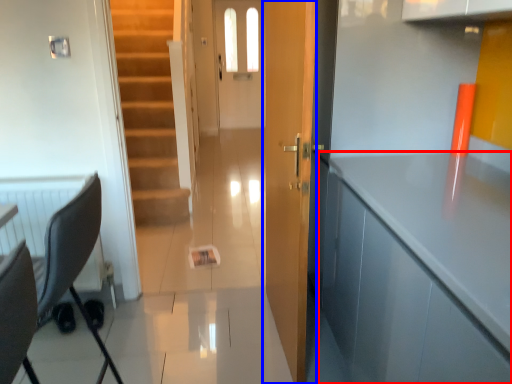
Question: Which object appears closest to the camera in this image, cabinetry (highlighted by a red box) or door (highlighted by a blue box)?

Choices:
 (A) cabinetry
 (B) door

Answer: (A)